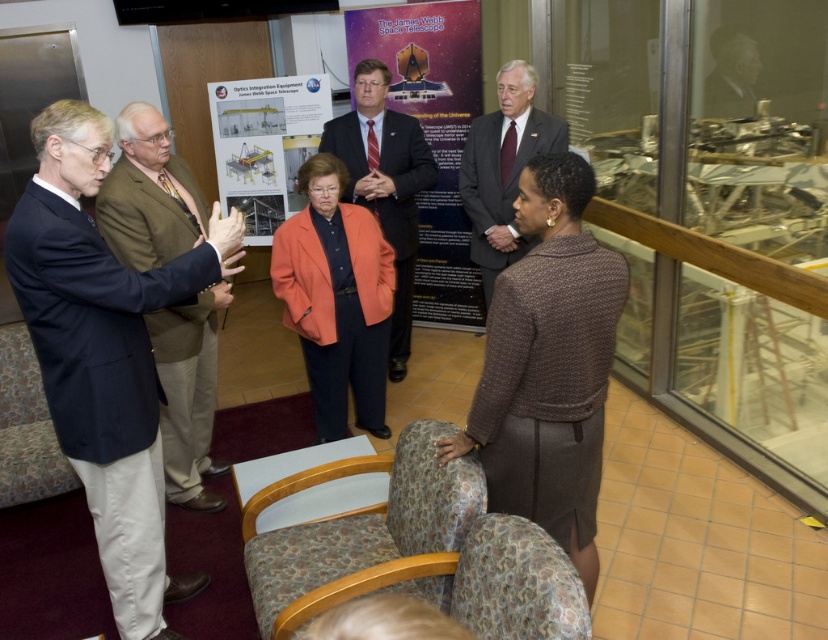
Question: Estimate the real-world distances between objects in this image. Which object is farther from the patterned fabric chair at lower center?

Choices:
 (A) dark blue suit at left
 (B) patterned fabric chair at lower left
 (C) orange fabric jacket at center

Answer: (B)

Question: Is the position of brown textured sweater at center more distant than that of orange fabric jacket at center?

Choices:
 (A) yes
 (B) no

Answer: (B)

Question: Observing the image, what is the correct spatial positioning of dark blue suit at left in reference to orange fabric jacket at center?

Choices:
 (A) below
 (B) above

Answer: (A)

Question: Is dark blue suit at left behind matte black poster at center?

Choices:
 (A) no
 (B) yes

Answer: (A)

Question: Which object is farther from the camera taking this photo?

Choices:
 (A) brown textured sweater at center
 (B) matte black poster at center

Answer: (B)

Question: Which point is farther to the camera?

Choices:
 (A) (393, 88)
 (B) (581, 198)
 (C) (455, 499)

Answer: (A)